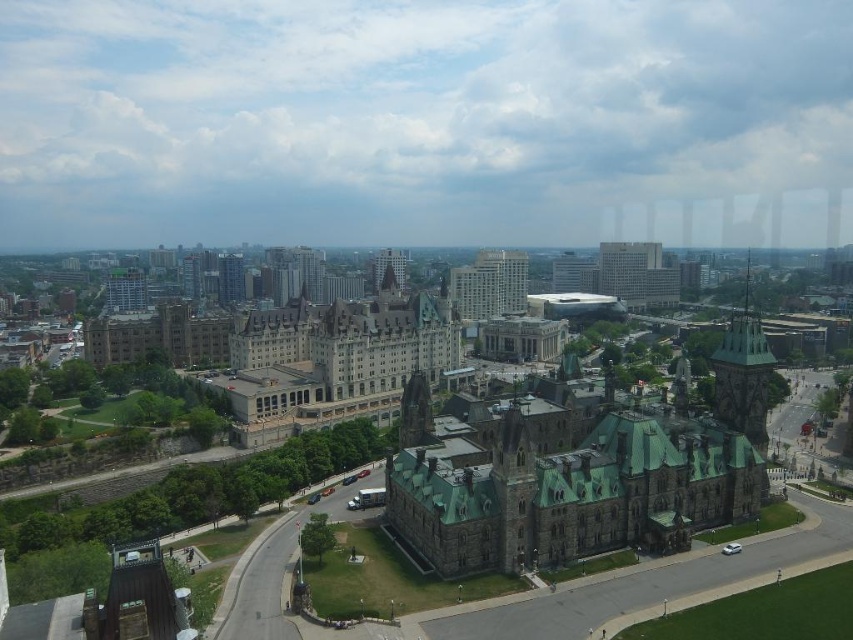
Question: Does brown stone tower at upper right appear on the left side of glassy blue skyscraper at center-left?

Choices:
 (A) no
 (B) yes

Answer: (A)

Question: Which of the following is the farthest from the observer?

Choices:
 (A) glassy blue skyscraper at center-left
 (B) dark gray stone tower at center
 (C) brown stone tower at upper right

Answer: (A)

Question: Is brown stone tower at upper right smaller than dark gray stone tower at center?

Choices:
 (A) yes
 (B) no

Answer: (B)

Question: Which of the following is the closest to the observer?

Choices:
 (A) dark gray stone tower at center
 (B) brown stone tower at upper right

Answer: (B)

Question: Which object is closer to the camera taking this photo?

Choices:
 (A) brown stone tower at upper right
 (B) dark gray stone tower at center
 (C) glassy blue skyscraper at center-left

Answer: (A)

Question: Is glassy blue skyscraper at center-left closer to the viewer compared to dark gray stone tower at center?

Choices:
 (A) yes
 (B) no

Answer: (B)